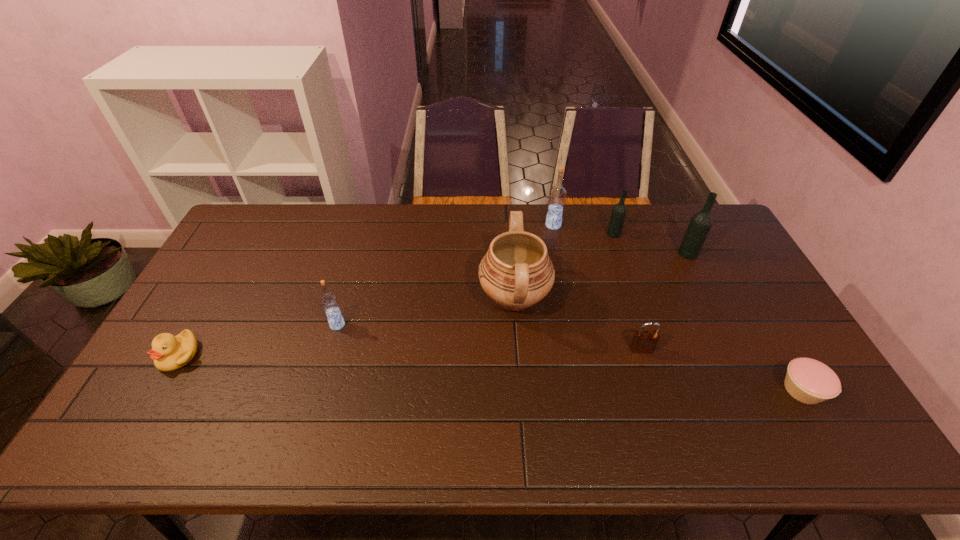
Identify the location of the second object from right to left. (700, 224).

You are a GUI agent. You are given a task and a screenshot of the screen. Output one action in this format:
    pyautogui.click(x=<x>, y=<y>)
    Task: Click on the bigger black vodka
    Image resolution: width=960 pixels, height=540 pixels.
    Given the screenshot: What is the action you would take?
    pyautogui.click(x=700, y=224)

Where is `the third vodka from right to left`? The height and width of the screenshot is (540, 960). the third vodka from right to left is located at coordinates (557, 194).

Locate an element on the screen. The image size is (960, 540). the fourth object from left to right is located at coordinates (557, 194).

Find the location of a particular element. the sixth object from right to left is located at coordinates (516, 272).

The height and width of the screenshot is (540, 960). What are the coordinates of `the smaller black vodka` in the screenshot? It's located at (619, 211).

Where is `the left black vodka`? This screenshot has width=960, height=540. the left black vodka is located at coordinates (619, 211).

This screenshot has width=960, height=540. I want to click on the leftmost vodka, so click(x=329, y=301).

The height and width of the screenshot is (540, 960). I want to click on the nearest vodka, so click(329, 301).

Locate an element on the screen. This screenshot has width=960, height=540. the third shortest object is located at coordinates (644, 341).